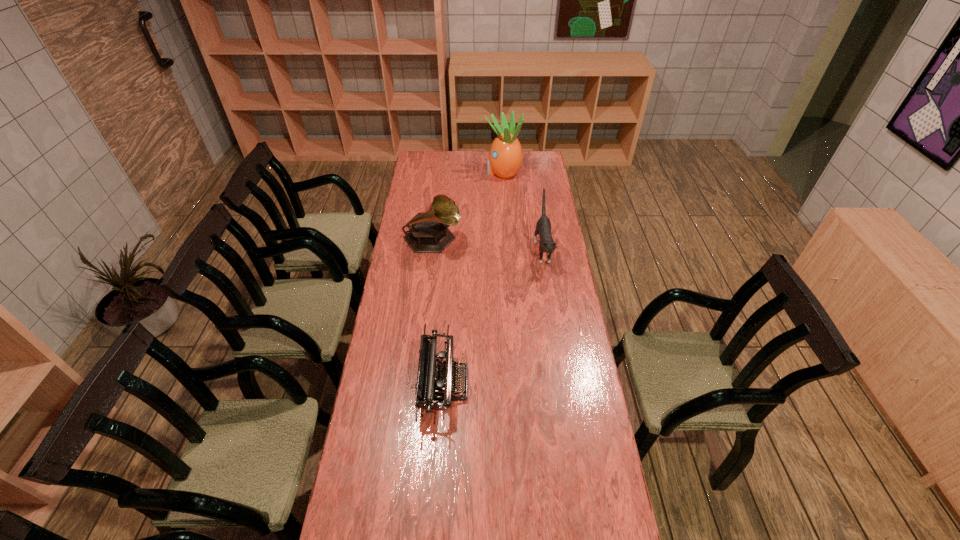
At what (x,y) coordinates should I click in order to perform the action: click on empty space between the rightmost object and the nearest object. Please return your answer as a coordinate pair (x, y). The image size is (960, 540). Looking at the image, I should click on (493, 316).

Where is `object that can be found as the second closest to the third object from left to right`? The width and height of the screenshot is (960, 540). object that can be found as the second closest to the third object from left to right is located at coordinates (543, 227).

Find the location of a particular element. This screenshot has height=540, width=960. object that is the closest to the tallest object is located at coordinates (428, 232).

Locate an element on the screen. This screenshot has height=540, width=960. free space in the image that satisfies the following two spatial constraints: 1. at the face of the cat; 2. on the typing side of the typewriter is located at coordinates (564, 384).